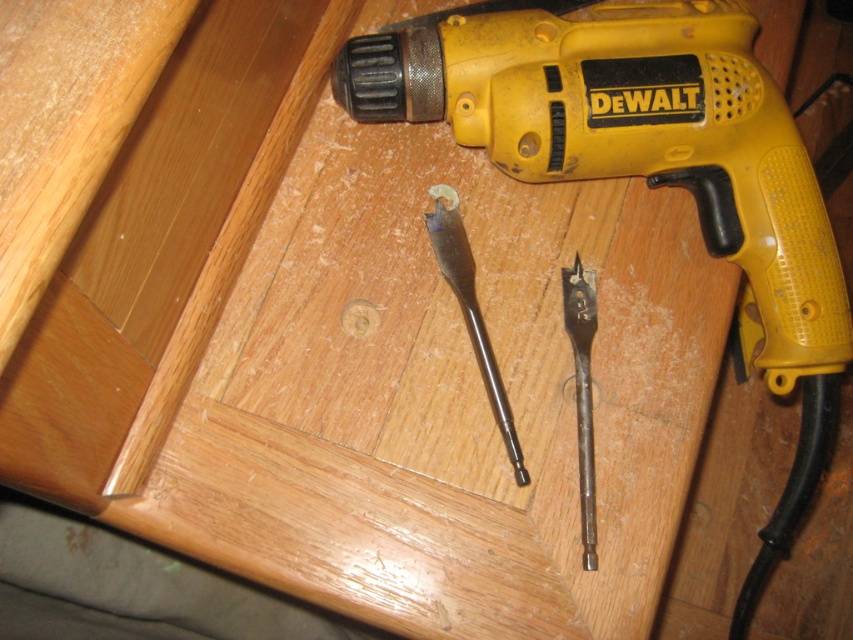
Question: Which object is the closest to the yellow plastic drill at upper right?

Choices:
 (A) black metal drill bit at center
 (B) matte metal drill bit at center

Answer: (B)

Question: Does matte metal drill bit at center have a lesser width compared to black metal drill bit at center?

Choices:
 (A) yes
 (B) no

Answer: (B)

Question: Which object appears closest to the camera in this image?

Choices:
 (A) matte metal drill bit at center
 (B) black metal drill bit at center
 (C) yellow plastic drill at upper right

Answer: (B)

Question: Which object is positioned closest to the matte metal drill bit at center?

Choices:
 (A) black metal drill bit at center
 (B) yellow plastic drill at upper right

Answer: (A)

Question: Is yellow plastic drill at upper right in front of black metal drill bit at center?

Choices:
 (A) yes
 (B) no

Answer: (B)

Question: Where is matte metal drill bit at center located in relation to black metal drill bit at center in the image?

Choices:
 (A) above
 (B) below

Answer: (A)